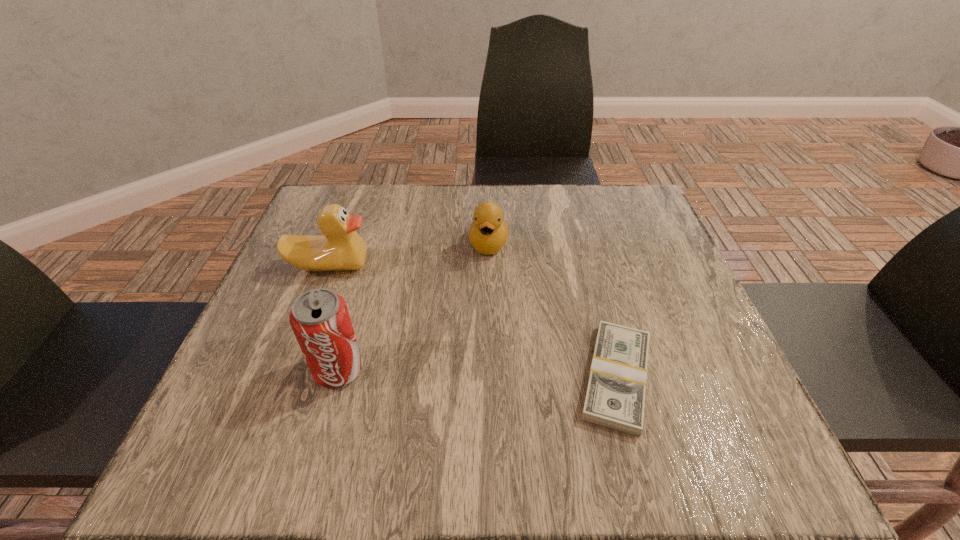
Locate an element on the screen. This screenshot has width=960, height=540. vacant area that lies between the third object from left to right and the duck is located at coordinates (409, 255).

The width and height of the screenshot is (960, 540). In order to click on free space between the shortest object and the third shortest object in this screenshot , I will do [x=473, y=321].

Where is `vacant region between the shortest object and the third shortest object`? vacant region between the shortest object and the third shortest object is located at coordinates (473, 321).

Locate an element on the screen. This screenshot has height=540, width=960. free space between the duck and the dollar is located at coordinates (473, 321).

The width and height of the screenshot is (960, 540). What are the coordinates of `free space between the second shortest object and the third shortest object` in the screenshot? It's located at (409, 255).

Where is `free space that is in between the third tallest object and the dollar`? The width and height of the screenshot is (960, 540). free space that is in between the third tallest object and the dollar is located at coordinates (553, 310).

Where is `unoccupied position between the third object from left to right and the shortest object`? The image size is (960, 540). unoccupied position between the third object from left to right and the shortest object is located at coordinates (553, 310).

Where is `free space between the soda can and the duckling`? free space between the soda can and the duckling is located at coordinates [x=414, y=307].

Choose which object is the nearest neighbor to the third object from left to right. Please provide its 2D coordinates. Your answer should be formatted as a tuple, i.e. [(x, y)], where the tuple contains the x and y coordinates of a point satisfying the conditions above.

[(615, 397)]

Identify which object is located as the second nearest to the shortest object. Please provide its 2D coordinates. Your answer should be formatted as a tuple, i.e. [(x, y)], where the tuple contains the x and y coordinates of a point satisfying the conditions above.

[(319, 318)]